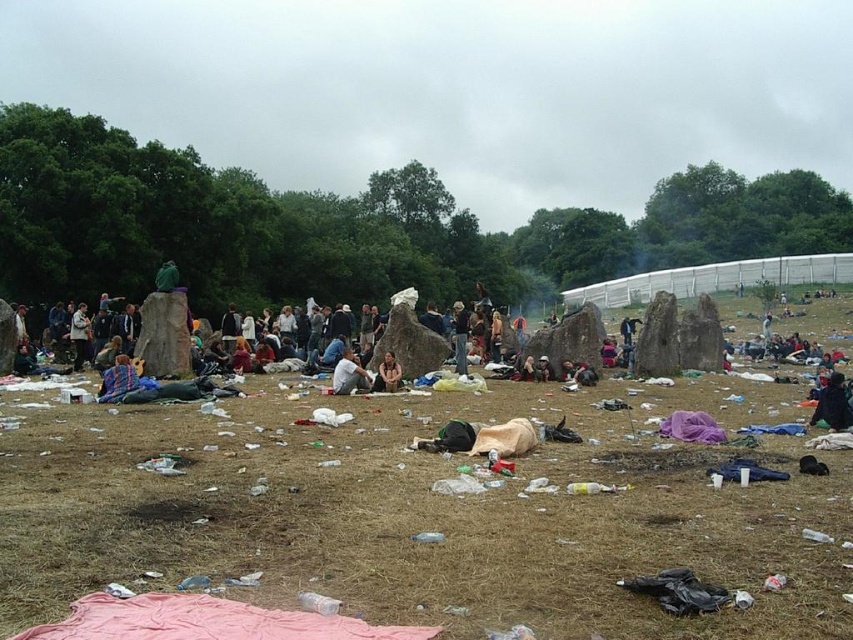
Can you confirm if black fabric bag at center is positioned below light brown fabric at center?

Yes.

The width and height of the screenshot is (853, 640). What are the coordinates of `black fabric bag at center` in the screenshot? It's located at (833, 404).

Between point (212, 532) and point (386, 358), which one is positioned behind?

The point (386, 358) is more distant.

Which is more to the left, brown dry grass at center or smooth brown leather jacket at center?

Positioned to the left is smooth brown leather jacket at center.

Is point (231, 420) closer to viewer compared to point (386, 353)?

That is True.

Where is `brown dry grass at center`? This screenshot has width=853, height=640. brown dry grass at center is located at coordinates (425, 509).

Is point (788, 618) positioned after point (840, 420)?

No, (788, 618) is in front of (840, 420).

The height and width of the screenshot is (640, 853). What are the coordinates of `brown dry grass at center` in the screenshot? It's located at (425, 509).

Where is `brown dry grass at center`? This screenshot has height=640, width=853. brown dry grass at center is located at coordinates (425, 509).